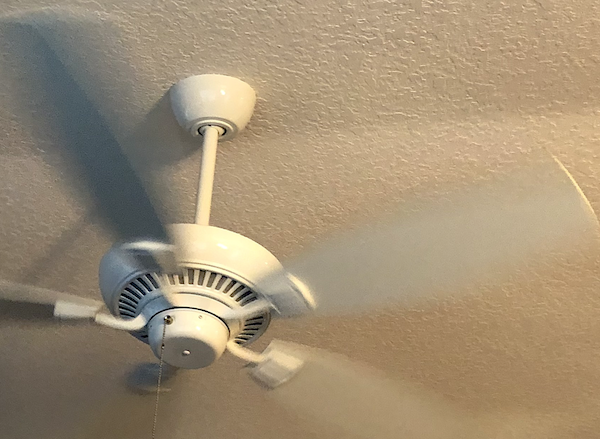
Identify the location of moving fan blades. Image resolution: width=600 pixels, height=439 pixels. (118, 129), (403, 270), (337, 390), (40, 304).